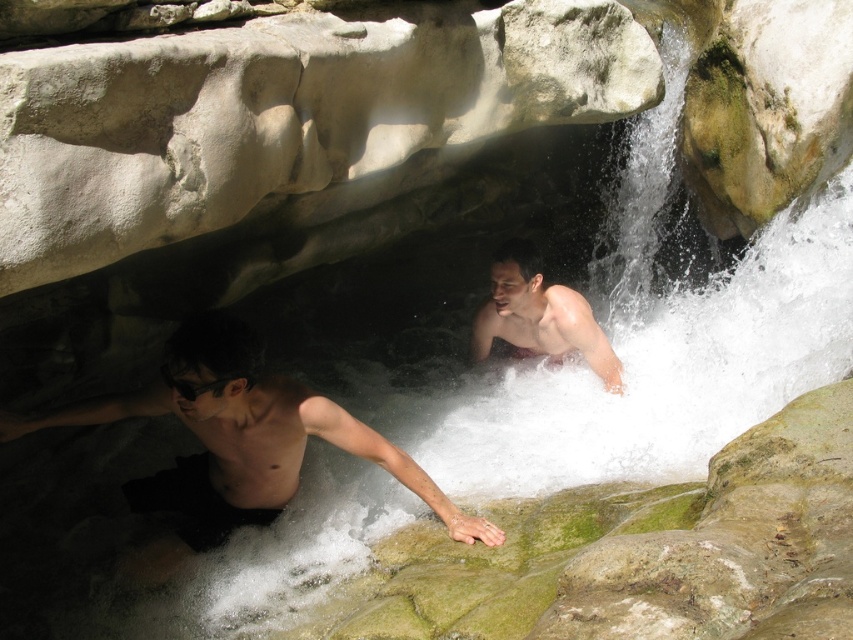
Question: Which of the following is the closest to the observer?

Choices:
 (A) (543, 340)
 (B) (138, 483)

Answer: (B)

Question: Can you confirm if dark skin man at left is thinner than smooth skin man at center?

Choices:
 (A) no
 (B) yes

Answer: (A)

Question: Is dark skin man at left positioned before smooth skin man at center?

Choices:
 (A) yes
 (B) no

Answer: (A)

Question: Can you confirm if dark skin man at left is positioned below smooth skin man at center?

Choices:
 (A) no
 (B) yes

Answer: (B)